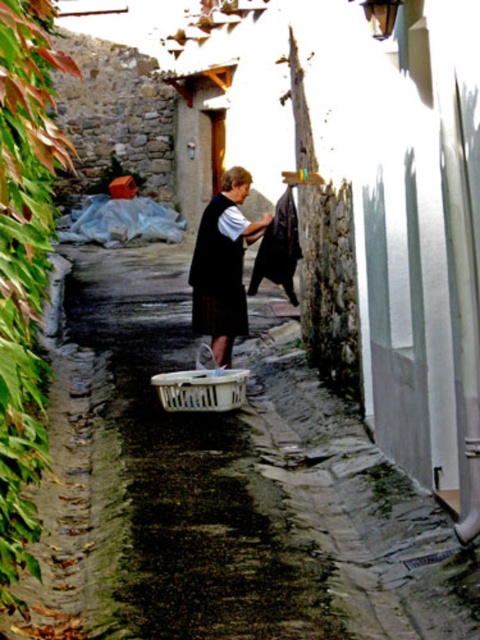
Does dark blue fabric dress at center appear over white plastic basket at center?

Yes.

Does dark blue fabric dress at center have a greater width compared to white plastic basket at center?

No.

Is point (230, 337) behind point (228, 397)?

Yes.

This screenshot has width=480, height=640. In order to click on dark blue fabric dress at center in this screenshot , I will do `click(218, 273)`.

How distant is matte black vest at center from white plastic basket at center?

matte black vest at center and white plastic basket at center are 35.11 inches apart.

Is point (240, 323) behind point (193, 396)?

Yes, point (240, 323) is behind point (193, 396).

This screenshot has width=480, height=640. Identify the location of matte black vest at center. (223, 266).

The height and width of the screenshot is (640, 480). I want to click on matte black vest at center, so click(x=223, y=266).

Is matte black vest at center above dark blue fabric dress at center?

Actually, matte black vest at center is below dark blue fabric dress at center.

Who is more forward, (238, 304) or (222, 253)?

Positioned in front is point (222, 253).

Where is `matte black vest at center`? matte black vest at center is located at coordinates (223, 266).